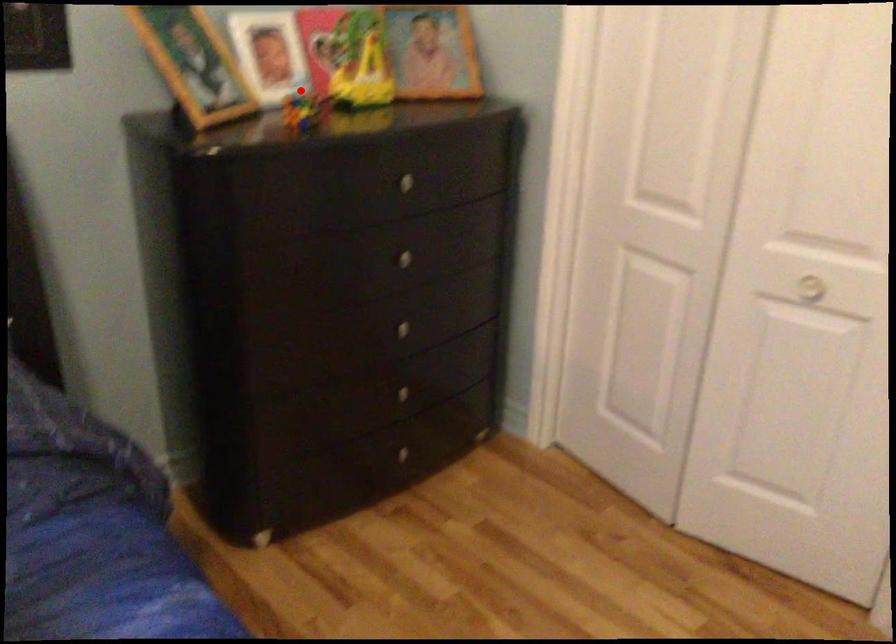
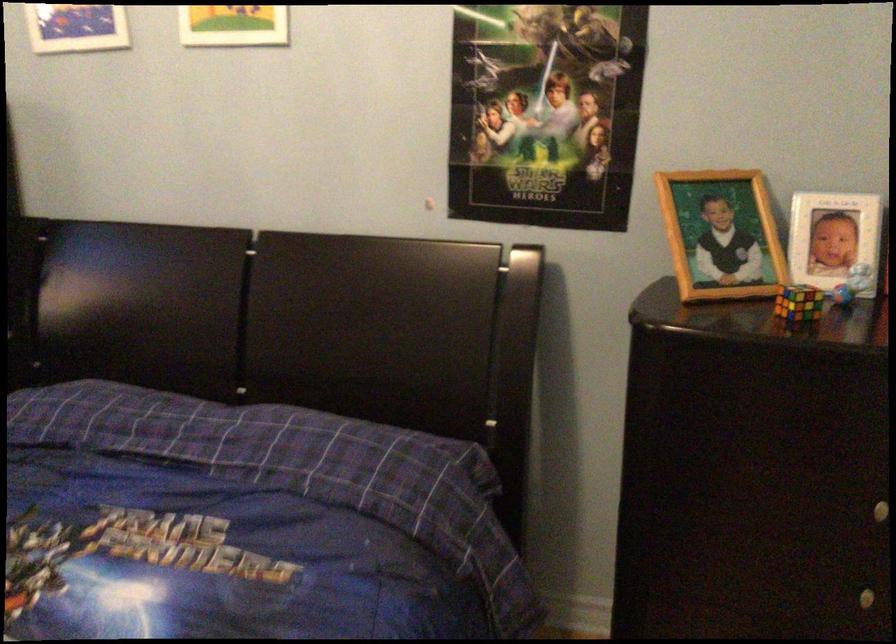
The point at the highlighted location is marked in the first image. Where is the corresponding point in the second image?

(851, 283)